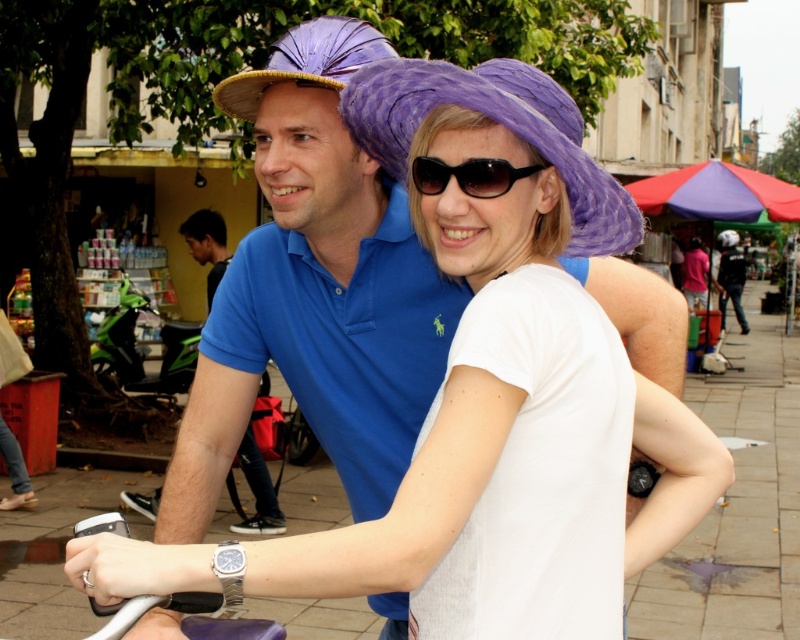
Looking at this image, you are a delivery person who needs to place a small package between the white matte helmet at upper right and the white matte hat at upper center. The package is 18 inches long. Can it fit between them without overlapping either object?

The distance between the white matte helmet at upper right and the white matte hat at upper center is 21.35 inches. Since the package is 18 inches long, it can fit between them as there is enough space without overlapping.

You are a photographer trying to capture both the purple paper hat at center and the white matte helmet at upper right in a single shot. Which object should you adjust your camera focus to first if you want to ensure the thinner one is in focus?

The purple paper hat at center is thinner than the white matte helmet at upper right, so you should focus on the purple paper hat at center first to ensure it is in focus.

You are a photographer trying to capture the purple paper hat at center in your shot. The camera has a focus point at coordinate 0.2, 0.6. Will the hat be in focus?

The purple paper hat at center is located at point (500,124), which is very close to the camera focus point at (480,128). The slight difference in coordinates means the hat should be in focus.